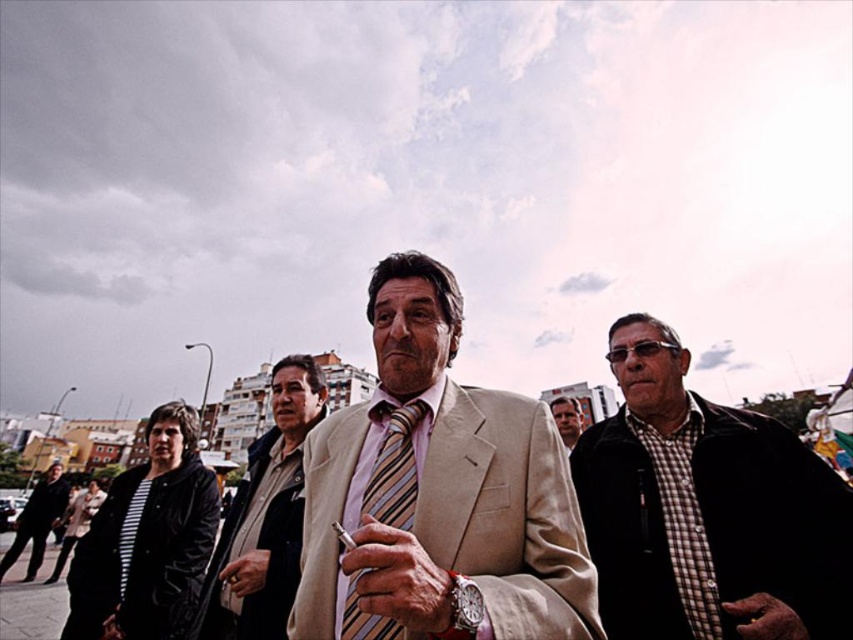
Is point (299, 595) farther from camera compared to point (393, 451)?

No.

Does beige fabric suit at center appear under striped fabric tie at center?

No, beige fabric suit at center is not below striped fabric tie at center.

Which is behind, point (399, 548) or point (415, 472)?

The point (415, 472) is behind.

Locate an element on the screen. beige fabric suit at center is located at coordinates (439, 488).

Between beige fabric suit at center and beige textured suit at center, which one is positioned higher?

beige fabric suit at center is above.

Does beige fabric suit at center have a greater height compared to beige textured suit at center?

Yes, beige fabric suit at center is taller than beige textured suit at center.

The height and width of the screenshot is (640, 853). What do you see at coordinates (439, 488) in the screenshot? I see `beige fabric suit at center` at bounding box center [439, 488].

Locate an element on the screen. This screenshot has width=853, height=640. beige fabric suit at center is located at coordinates (439, 488).

Between striped fabric tie at center and black leather jacket at lower left, which one is positioned lower?

black leather jacket at lower left is lower down.

The width and height of the screenshot is (853, 640). Describe the element at coordinates (395, 467) in the screenshot. I see `striped fabric tie at center` at that location.

Where is `striped fabric tie at center`? The height and width of the screenshot is (640, 853). striped fabric tie at center is located at coordinates (395, 467).